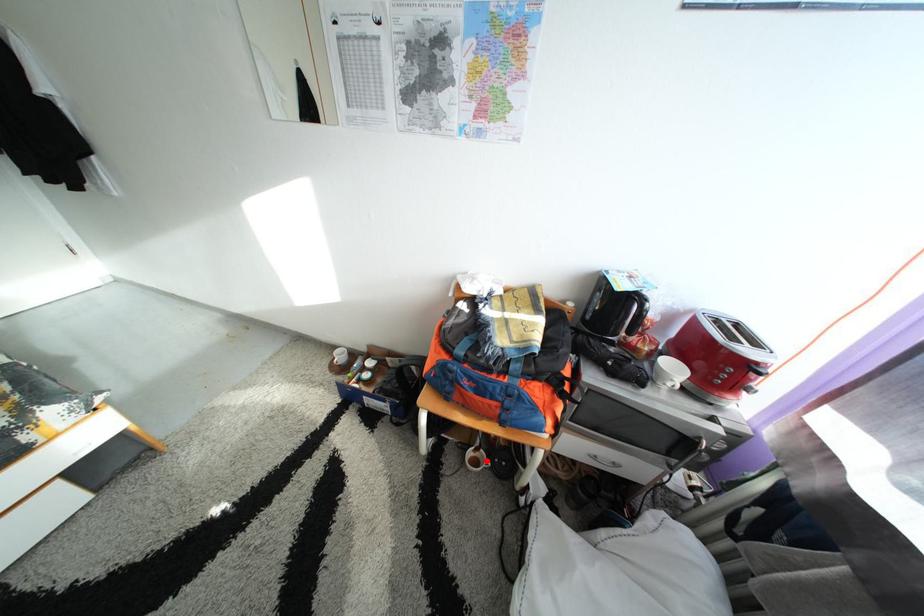
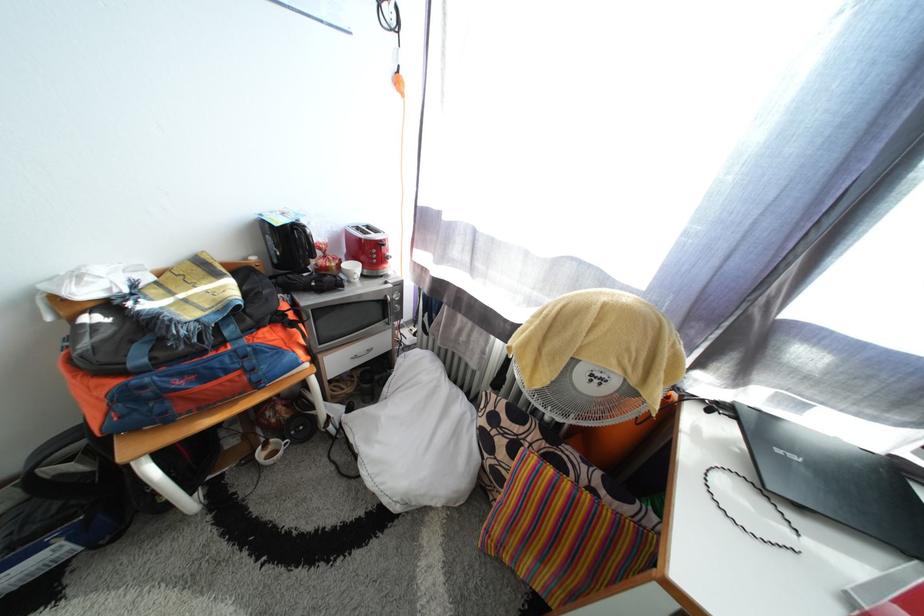
Question: A red point is marked in image1. In image2, is the corresponding 3D point closer to the camera or farther? Reply with the corresponding letter.

Choices:
 (A) The corresponding 3D point is closer.
 (B) The corresponding 3D point is farther.

Answer: (A)